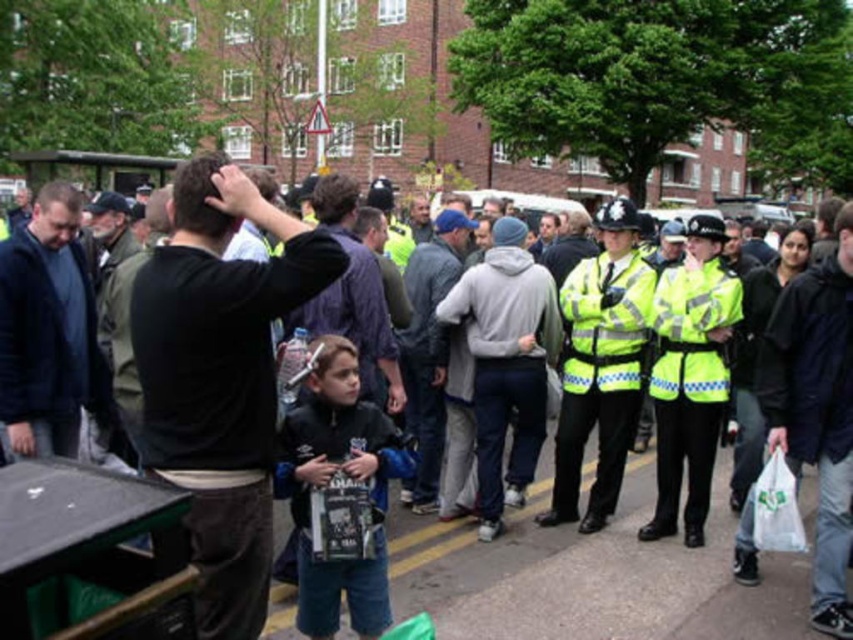
Looking at this image, is black cotton shirt at center behind dark blue jacket at left?

No.

Measure the distance between point (238, 522) and camera.

They are 7.62 meters apart.

Is point (268, 300) less distant than point (65, 232)?

Yes, it is.

Locate an element on the screen. This screenshot has height=640, width=853. black cotton shirt at center is located at coordinates (219, 376).

Between point (761, 365) and point (662, 509), which one is positioned in front?

Point (761, 365) is in front.

The height and width of the screenshot is (640, 853). Find the location of `dark blue jacket at right`. dark blue jacket at right is located at coordinates (816, 410).

Is high-visibility reflective jacket at center taller than high-visibility reflective jacket at center-right?

Indeed, high-visibility reflective jacket at center has a greater height compared to high-visibility reflective jacket at center-right.

Who is more distant from viewer, (569, 400) or (706, 433)?

Point (569, 400)

Between point (608, 499) and point (698, 241), which one is positioned behind?

The point (608, 499) is more distant.

The height and width of the screenshot is (640, 853). Identify the location of high-visibility reflective jacket at center. (601, 365).